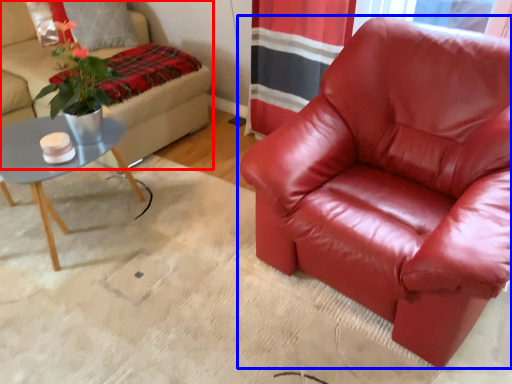
Question: Which of the following is the closest to the observer, studio couch (highlighted by a red box) or chair (highlighted by a blue box)?

Choices:
 (A) studio couch
 (B) chair

Answer: (B)